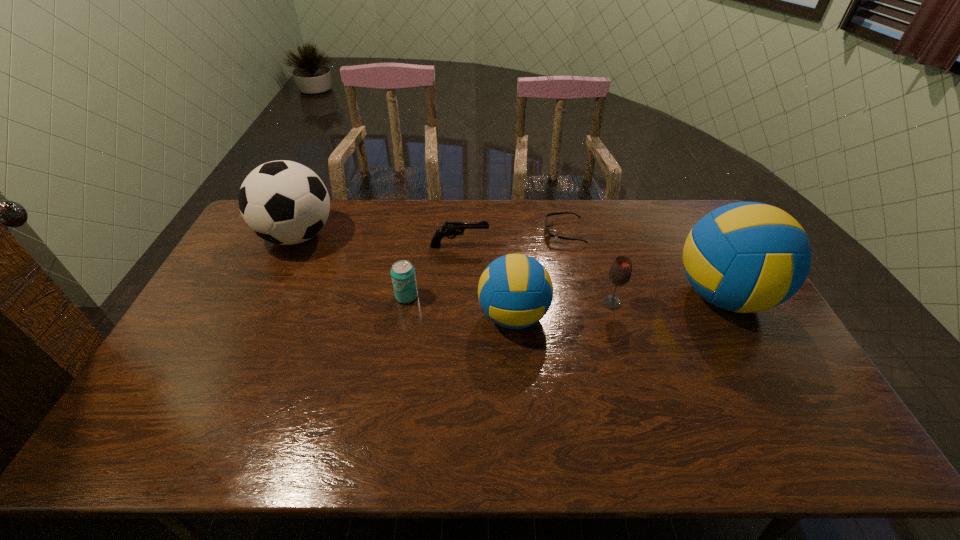
Where is `vacant place for an extra volleyball on the left`? vacant place for an extra volleyball on the left is located at coordinates (284, 339).